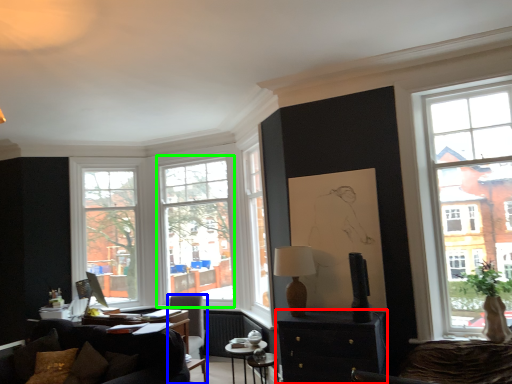
Question: Considering the real-world distances, which object is closest to cabinetry (highlighted by a red box)? chair (highlighted by a blue box) or window (highlighted by a green box).

Choices:
 (A) chair
 (B) window

Answer: (A)